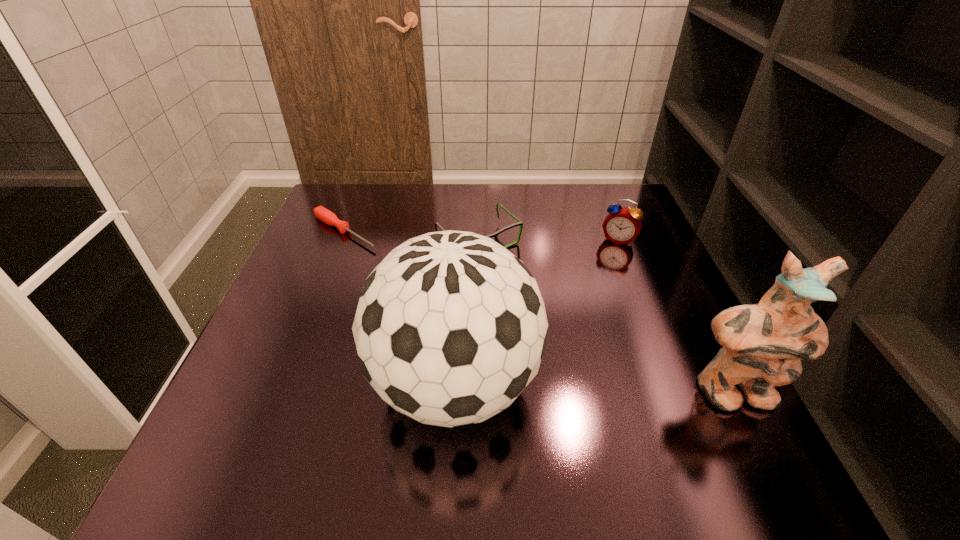
At what (x,y) coordinates should I click in order to perform the action: click on vacant space situated 0.120m on the front-facing side of the third shortest object. Please return your answer as a coordinate pair (x, y). Image resolution: width=960 pixels, height=540 pixels. Looking at the image, I should click on (603, 276).

Locate an element on the screen. The width and height of the screenshot is (960, 540). vacant space located 0.340m on the front-facing side of the third shortest object is located at coordinates (579, 340).

I want to click on free spot located 0.090m on the front-facing side of the third shortest object, so click(606, 268).

You are a GUI agent. You are given a task and a screenshot of the screen. Output one action in this format:
    pyautogui.click(x=<x>, y=<y>)
    Task: Click on the free location located 0.370m at the tip of the leftmost object
    Image resolution: width=960 pixels, height=540 pixels.
    Given the screenshot: What is the action you would take?
    point(474,311)

This screenshot has height=540, width=960. Find the location of `free space located 0.310m at the tip of the leftmost object`. free space located 0.310m at the tip of the leftmost object is located at coordinates (454, 299).

Where is `vacant space located at the tip of the leftmost object`? vacant space located at the tip of the leftmost object is located at coordinates (450, 296).

I want to click on spectacles that is at the far edge, so click(x=519, y=223).

The height and width of the screenshot is (540, 960). I want to click on screwdriver present at the far edge, so click(x=320, y=212).

Find the location of `soccer ball that is at the near edge`. soccer ball that is at the near edge is located at coordinates click(450, 328).

I want to click on figurine present at the near edge, so click(763, 344).